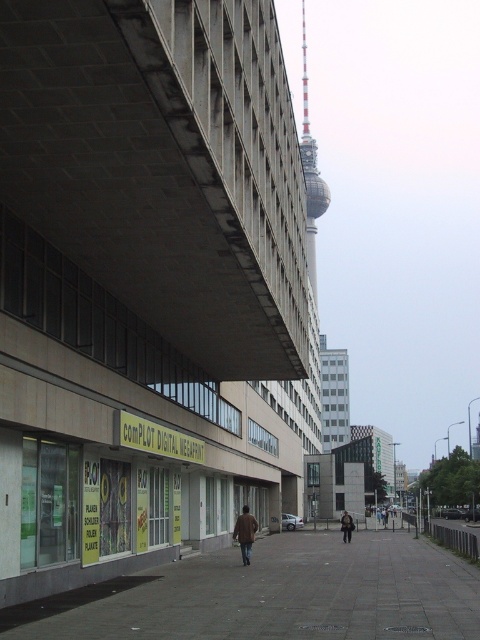
Question: Which of the following is the farthest from the observer?

Choices:
 (A) dark brown leather jacket at center
 (B) gray concrete pavement at center

Answer: (A)

Question: Can you confirm if dark brown leather jacket at center is positioned to the left of brown leather jacket at center?

Choices:
 (A) no
 (B) yes

Answer: (B)

Question: Does brown leather coat at center have a lesser width compared to dark brown leather jacket at center?

Choices:
 (A) no
 (B) yes

Answer: (B)

Question: Which object is positioned closest to the brown leather jacket at center?

Choices:
 (A) brown leather coat at center
 (B) concrete at upper left
 (C) gray concrete pavement at center

Answer: (C)

Question: Among these points, which one is nearest to the camera?

Choices:
 (A) (249, 516)
 (B) (454, 579)
 (C) (153, 268)
 (D) (345, 524)

Answer: (C)

Question: Can you confirm if brown leather coat at center is wider than dark brown leather jacket at center?

Choices:
 (A) yes
 (B) no

Answer: (B)